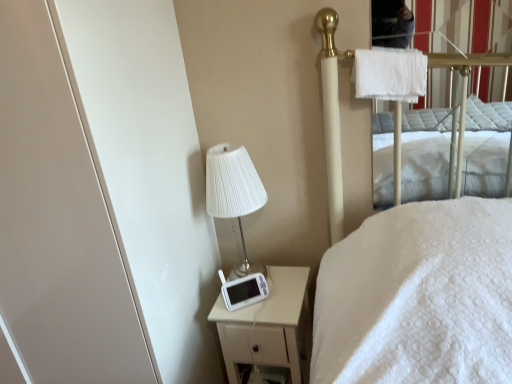
Question: Is white glossy screen door at left to the left of white fluffy towel at upper right from the viewer's perspective?

Choices:
 (A) no
 (B) yes

Answer: (B)

Question: Can you confirm if white glossy screen door at left is shorter than white fluffy towel at upper right?

Choices:
 (A) no
 (B) yes

Answer: (A)

Question: Considering the relative sizes of white glossy screen door at left and white fluffy towel at upper right in the image provided, is white glossy screen door at left bigger than white fluffy towel at upper right?

Choices:
 (A) yes
 (B) no

Answer: (A)

Question: Is white glossy screen door at left not near white fluffy towel at upper right?

Choices:
 (A) no
 (B) yes

Answer: (A)

Question: Is white glossy screen door at left at the right side of white fluffy towel at upper right?

Choices:
 (A) no
 (B) yes

Answer: (A)

Question: Visually, is white matte nightstand at lower right positioned to the left or to the right of white fluffy towel at upper right?

Choices:
 (A) right
 (B) left

Answer: (B)

Question: From a real-world perspective, is white matte nightstand at lower right positioned above or below white fluffy towel at upper right?

Choices:
 (A) below
 (B) above

Answer: (A)

Question: Is white matte nightstand at lower right in front of or behind white fluffy towel at upper right in the image?

Choices:
 (A) front
 (B) behind

Answer: (B)

Question: Looking at their shapes, would you say white matte nightstand at lower right is wider or thinner than white fluffy towel at upper right?

Choices:
 (A) wide
 (B) thin

Answer: (A)

Question: From a real-world perspective, is white fluffy towel at upper right above or below white pleated fabric lampshade at upper left?

Choices:
 (A) above
 (B) below

Answer: (A)

Question: Is white fluffy towel at upper right inside or outside of white pleated fabric lampshade at upper left?

Choices:
 (A) inside
 (B) outside

Answer: (B)

Question: Is white fluffy towel at upper right to the left or to the right of white pleated fabric lampshade at upper left in the image?

Choices:
 (A) left
 (B) right

Answer: (B)

Question: Is white fluffy towel at upper right in front of or behind white pleated fabric lampshade at upper left in the image?

Choices:
 (A) behind
 (B) front

Answer: (B)

Question: From their relative heights in the image, would you say white pleated fabric lampshade at upper left is taller or shorter than white matte nightstand at lower right?

Choices:
 (A) tall
 (B) short

Answer: (B)

Question: Is white pleated fabric lampshade at upper left spatially inside white matte nightstand at lower right, or outside of it?

Choices:
 (A) inside
 (B) outside

Answer: (B)